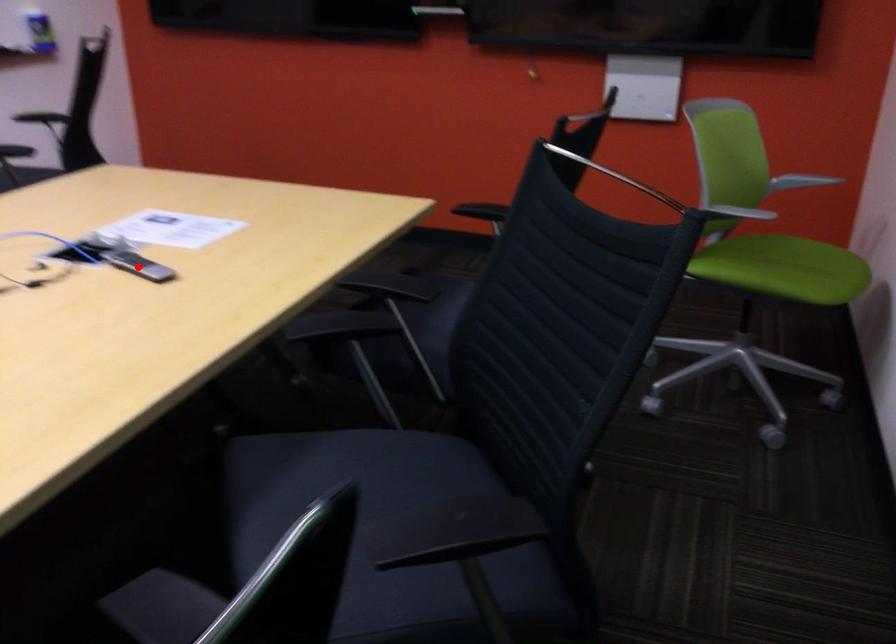
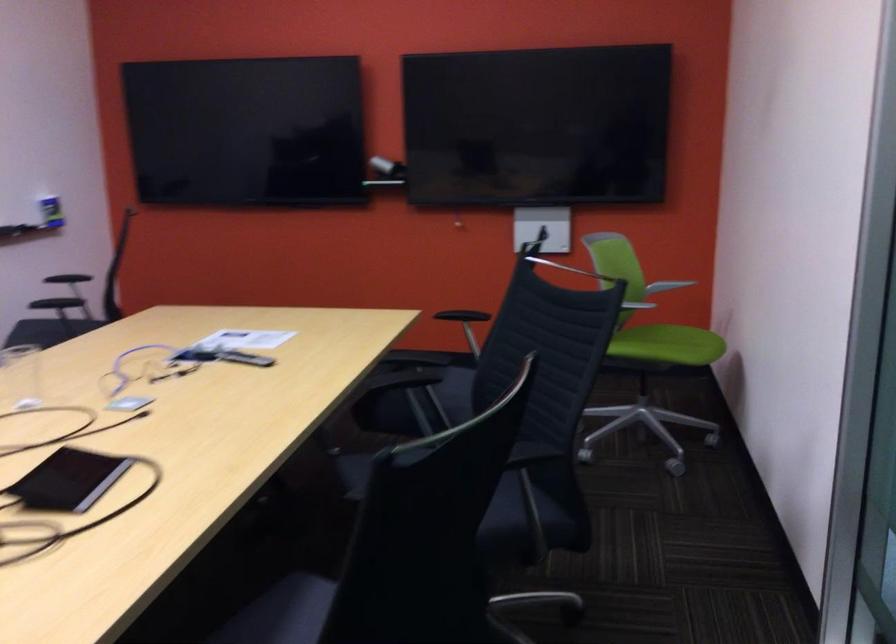
Question: I am providing you with two images of the same scene from different viewpoints. Image1 has a red point marked. In image2, the corresponding 3D location appears at what relative position? Reply with the corresponding letter.

Choices:
 (A) Closer
 (B) Farther

Answer: (B)